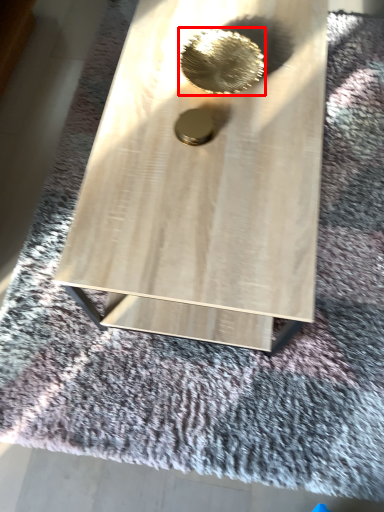
Question: In this image, where is hole (annotated by the red box) located relative to hole?

Choices:
 (A) left
 (B) right

Answer: (B)